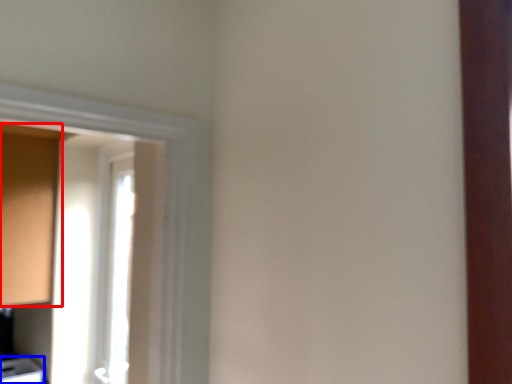
Question: Among these objects, which one is nearest to the camera, cabinetry (highlighted by a red box) or cabinetry (highlighted by a blue box)?

Choices:
 (A) cabinetry
 (B) cabinetry

Answer: (A)